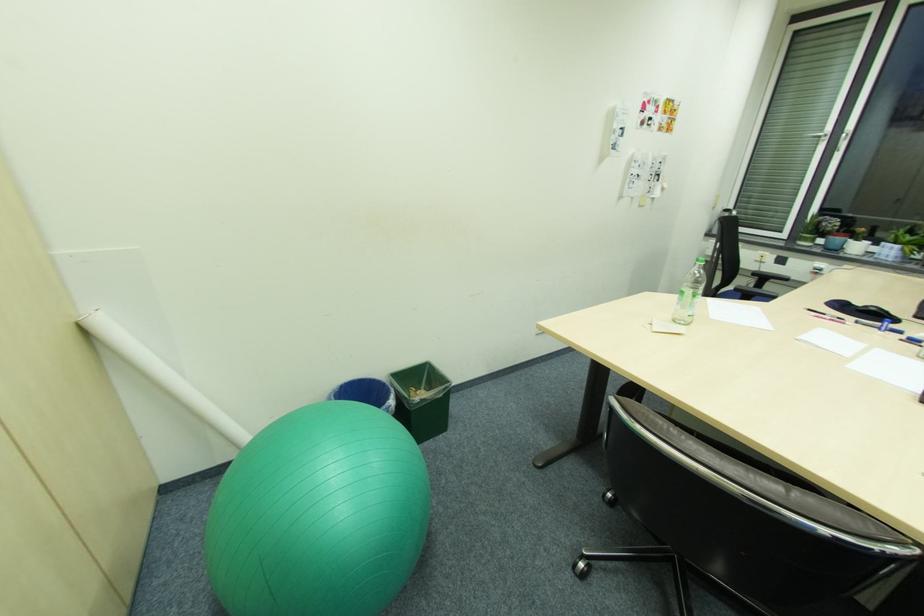
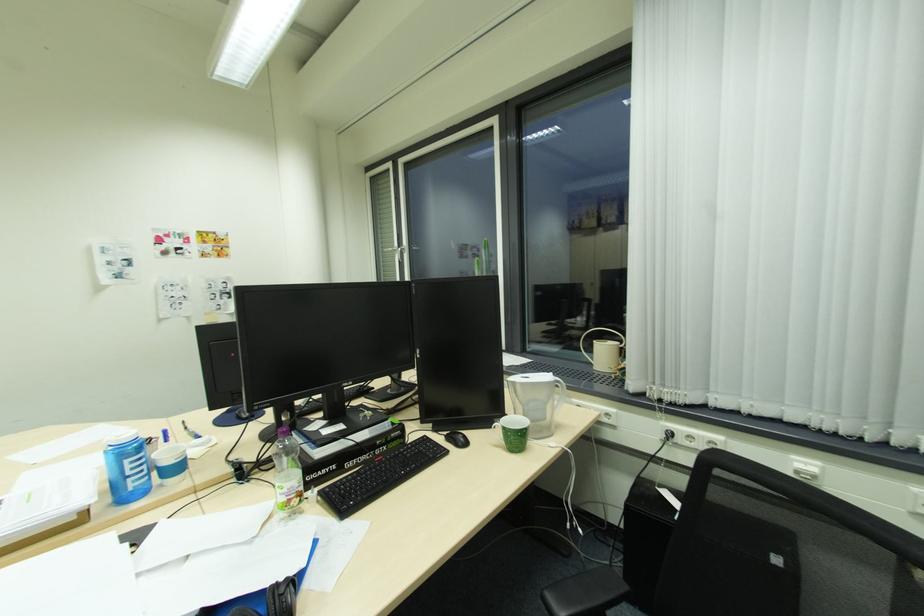
Where in the second image is the point corresponding to [833,136] from the first image?

(400, 251)